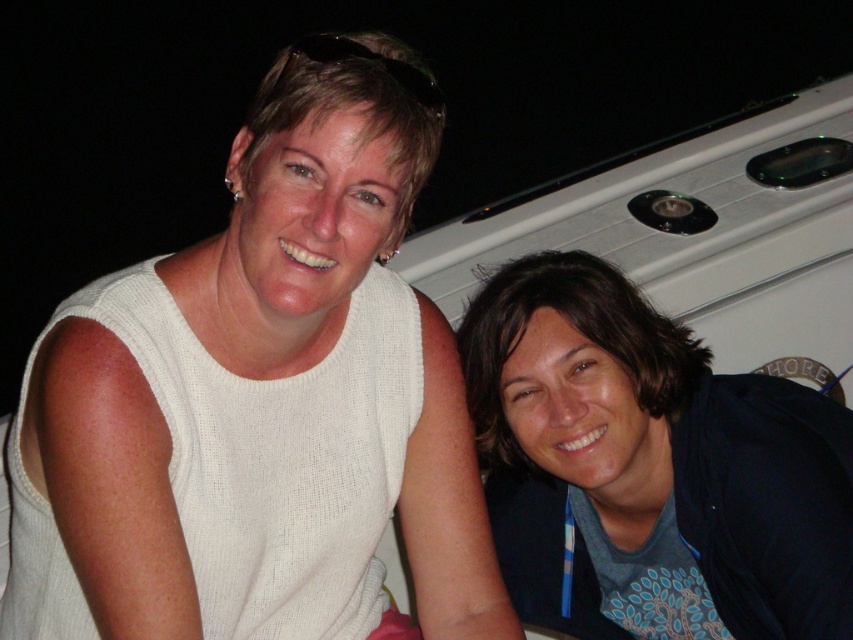
You are a photographer trying to capture a closeup of the white knitted sweater at upper left and the dark blue fabric at lower right in the image. Which object should you focus on first if you want to ensure both are in focus, considering their positions relative to the camera?

The white knitted sweater at upper left is located above the dark blue fabric at lower right. Since the sweater is higher up, focusing on it first would help ensure both are in focus as the fabric is lower and closer to the camera.